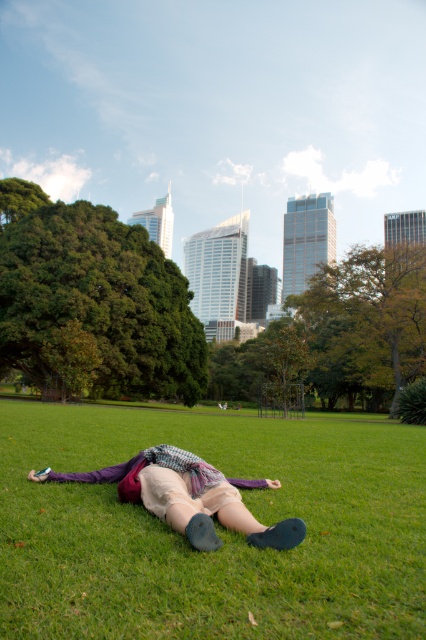
You are standing in the park and want to take a photo of both point (360,545) and point (173,522) in the image. Since you want both points to be in focus, which point should you focus on to ensure the other is also sharp?

You should focus on point (173,522) because it is farther from the camera than point (360,545). By focusing on the farther point, the closer point will also be within the depth of field, ensuring both are sharp.

You are a drone operator tasked with capturing aerial footage of the park. Your drone is currently hovering above the green grass at center and the matte purple sweater at center. To ensure safety, you need to know the distance between these two objects. Can you confirm if the distance is sufficient for the drone to navigate between them without any obstacles?

The green grass at center is 4.88 meters away from the matte purple sweater at center. This distance is sufficient for the drone to navigate between them safely as long as there are no other obstacles in the immediate area.

Looking at this image, you are a photographer planning to capture a closeup of the matte purple sweater at center while ensuring the green grass at center is still visible in the frame. Given their sizes, which object should you focus on to include both in the shot?

The green grass at center is wider than the matte purple sweater at center, so focusing on the green grass at center will allow both objects to fit within the frame since it occupies more space.